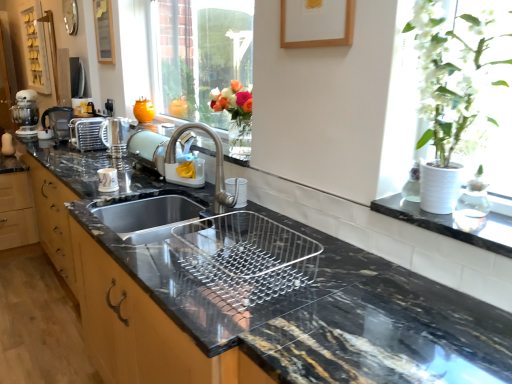
Question: In the image, is metallic silver coffee machine at left on the left side or the right side of wooden picture frame at upper left, the 2th picture frame in the front-to-back sequence?

Choices:
 (A) left
 (B) right

Answer: (A)

Question: From a real-world perspective, relative to wooden picture frame at upper left, which ranks as the first picture frame in top-to-bottom order, is metallic silver coffee machine at left vertically above or below?

Choices:
 (A) below
 (B) above

Answer: (A)

Question: Estimate the real-world distances between objects in this image. Which object is farther from the wooden picture frame at upper center, the second picture frame from the left?

Choices:
 (A) black marble sink at center
 (B) wooden picture frame at upper left, positioned as the second picture frame in bottom-to-top order
 (C) orange matte vase at upper center
 (D) white matte vase at upper right
 (E) metallic silver coffee machine at left

Answer: (E)

Question: Estimate the real-world distances between objects in this image. Which object is farther from the metallic oak cabinet at left?

Choices:
 (A) metallic silver coffee machine at left
 (B) black marble sink at center
 (C) satin nickel kettle at center, the second appliance in the back-to-front sequence
 (D) white matte vase at upper right
 (E) clear glass window at center

Answer: (E)